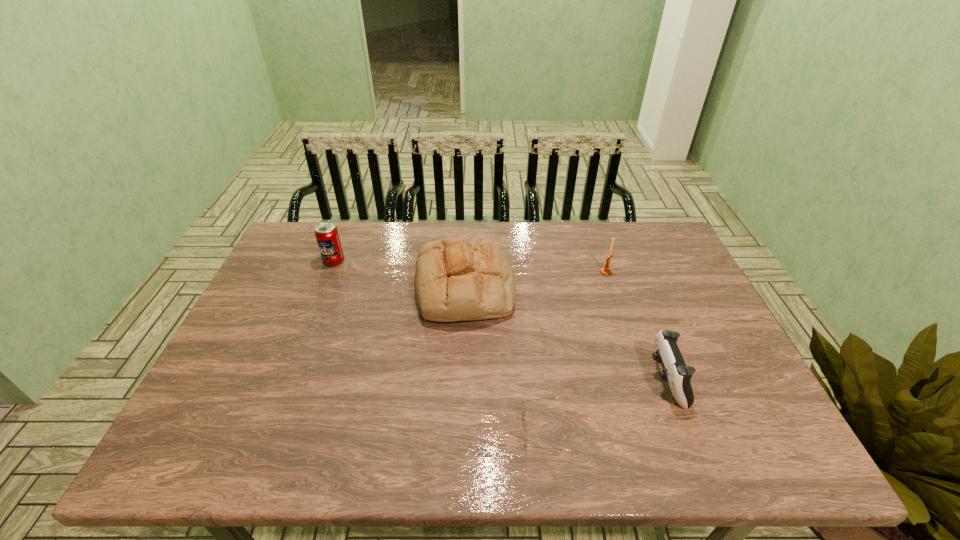
The height and width of the screenshot is (540, 960). Find the location of `free point at the far edge`. free point at the far edge is located at coordinates (414, 233).

Locate an element on the screen. The image size is (960, 540). vacant position at the near edge of the desktop is located at coordinates (578, 434).

Locate an element on the screen. free region at the left edge is located at coordinates (318, 277).

You are a GUI agent. You are given a task and a screenshot of the screen. Output one action in this format:
    pyautogui.click(x=<x>, y=<y>)
    Task: Click on the blank space at the right edge of the desktop
    
    Given the screenshot: What is the action you would take?
    pyautogui.click(x=666, y=293)

Locate an element on the screen. The width and height of the screenshot is (960, 540). free space at the near left corner of the desktop is located at coordinates (242, 458).

At what (x,y) coordinates should I click in order to perform the action: click on vacant region at the far right corner. Please return your answer as a coordinate pair (x, y). Image resolution: width=960 pixels, height=540 pixels. Looking at the image, I should click on (637, 257).

Image resolution: width=960 pixels, height=540 pixels. In order to click on free point between the candle_holder and the rightmost object in this screenshot , I will do `click(636, 326)`.

Where is `vacant area between the spectacles and the leftmost object`? vacant area between the spectacles and the leftmost object is located at coordinates (441, 345).

Identify the location of empty space that is in between the fourth tallest object and the bread. The image size is (960, 540). (565, 334).

Where is `empty location between the shortest object and the soda can`? This screenshot has height=540, width=960. empty location between the shortest object and the soda can is located at coordinates (441, 345).